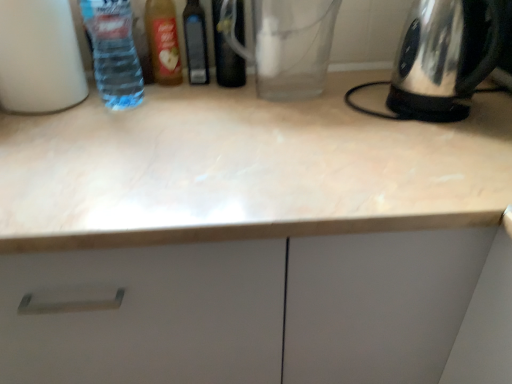
Question: From the image's perspective, is transparent glass bottle at center, marked as the first bottle in a right-to-left arrangement, positioned above or below white matte bottle at left, the 1th bottle viewed from the left?

Choices:
 (A) above
 (B) below

Answer: (A)

Question: In terms of width, does transparent glass bottle at center, the fifth bottle when ordered from left to right, look wider or thinner when compared to white matte bottle at left, the 5th bottle positioned from the right?

Choices:
 (A) thin
 (B) wide

Answer: (A)

Question: Considering the real-world distances, which object is closest to the white marble countertop at center?

Choices:
 (A) white matte bottle at left, the 1th bottle viewed from the left
 (B) transparent glass bottle at center, the fifth bottle when ordered from left to right
 (C) transparent glass coffee pot at center
 (D) black plastic bottle at center, the second bottle from the right
 (E) translucent plastic bottle at upper left, which appears as the 4th bottle when viewed from the right

Answer: (C)

Question: Which object is positioned farthest from the stainless steel kettle at right?

Choices:
 (A) white matte bottle at left, the 5th bottle positioned from the right
 (B) transparent glass coffee pot at center
 (C) transparent glass bottle at center, the fifth bottle when ordered from left to right
 (D) white marble countertop at center
 (E) translucent plastic bottle at upper left, positioned as the 2th bottle in left-to-right order

Answer: (A)